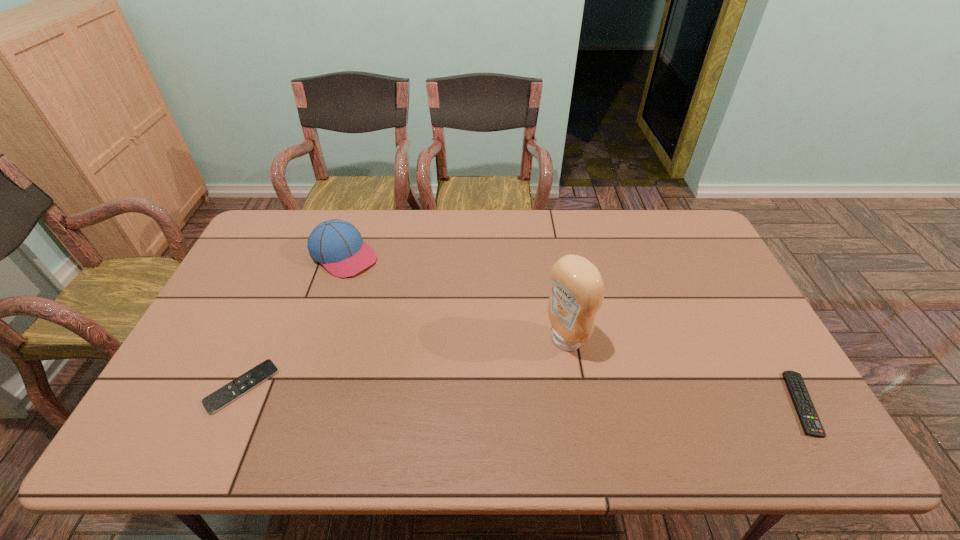
This screenshot has height=540, width=960. I want to click on vacant area that lies between the shorter remote control and the taller remote control, so click(x=521, y=395).

The image size is (960, 540). What are the coordinates of `empty location between the shorter remote control and the third shortest object` in the screenshot? It's located at (293, 321).

Where is `free space that is in between the tallest object and the baseball cap`? free space that is in between the tallest object and the baseball cap is located at coordinates (455, 298).

Point out which object is positioned as the third nearest to the condiment. Please provide its 2D coordinates. Your answer should be formatted as a tuple, i.e. [(x, y)], where the tuple contains the x and y coordinates of a point satisfying the conditions above.

[(222, 397)]

Choose which object is the nearest neighbor to the farthest object. Please provide its 2D coordinates. Your answer should be formatted as a tuple, i.e. [(x, y)], where the tuple contains the x and y coordinates of a point satisfying the conditions above.

[(222, 397)]

Identify the location of free spot that satisfies the following two spatial constraints: 1. on the front side of the taller remote control; 2. on the right side of the tallest object. pyautogui.click(x=576, y=403).

The height and width of the screenshot is (540, 960). In order to click on free space that satisfies the following two spatial constraints: 1. on the front side of the shortest object; 2. on the left side of the taller remote control in this screenshot , I will do (234, 403).